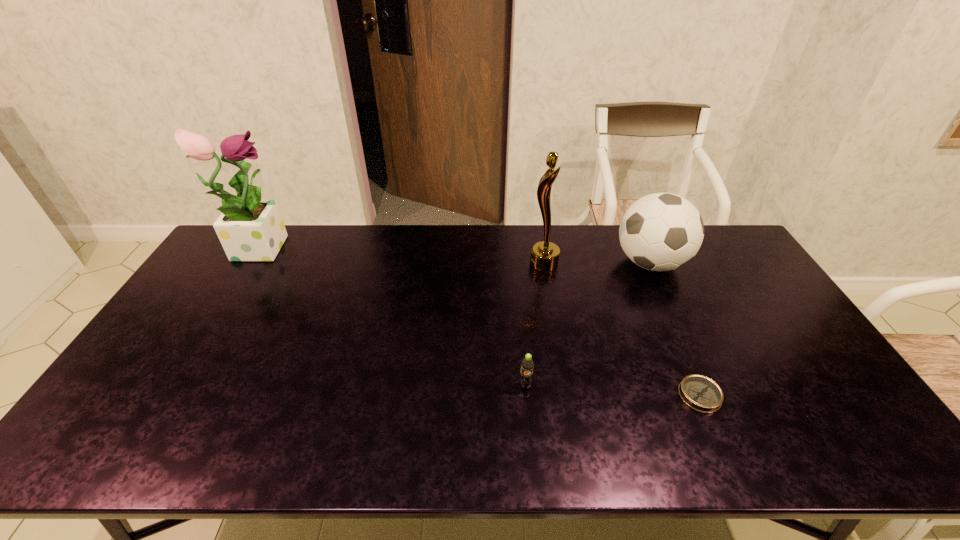
Where is `flower arrangement`? This screenshot has height=540, width=960. flower arrangement is located at coordinates (250, 229).

Locate an element on the screen. award is located at coordinates (544, 256).

The image size is (960, 540). I want to click on the third tallest object, so click(662, 231).

The height and width of the screenshot is (540, 960). In order to click on soda in this screenshot , I will do `click(527, 364)`.

Locate an element on the screen. the fourth object from right to left is located at coordinates (527, 364).

Locate an element on the screen. Image resolution: width=960 pixels, height=540 pixels. compass is located at coordinates (699, 392).

This screenshot has height=540, width=960. I want to click on free space located on the front-facing side of the flower arrangement, so click(x=390, y=246).

Where is `blank space located on the front-facing side of the award`? The width and height of the screenshot is (960, 540). blank space located on the front-facing side of the award is located at coordinates (414, 264).

I want to click on vacant space situated on the front-facing side of the award, so click(x=507, y=264).

Where is `free region located 0.210m on the front-facing side of the award`? free region located 0.210m on the front-facing side of the award is located at coordinates (469, 264).